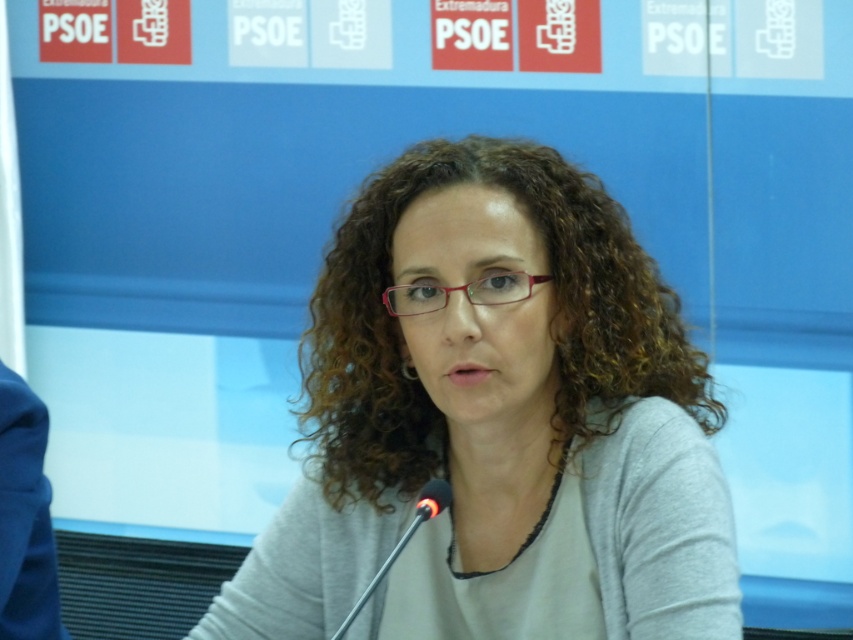
You are a photographer at the event and want to capture a closeup of the woman speaking. You notice the gray matte sweater at center and the black plastic microphone at center. Which object is positioned to the right of the other?

The gray matte sweater at center is to the right of the black plastic microphone at center.